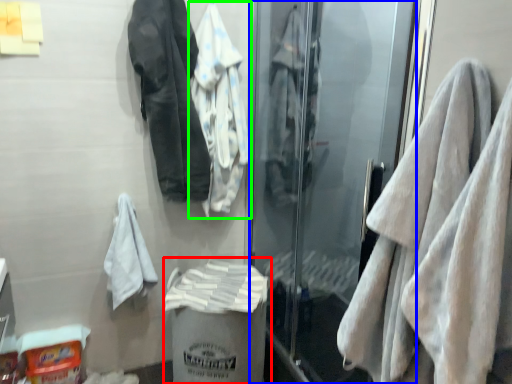
Question: Estimate the real-world distances between objects in this image. Which object is farther from garbage (highlighted by a red box), screen door (highlighted by a blue box) or jacket (highlighted by a green box)?

Choices:
 (A) screen door
 (B) jacket

Answer: (B)